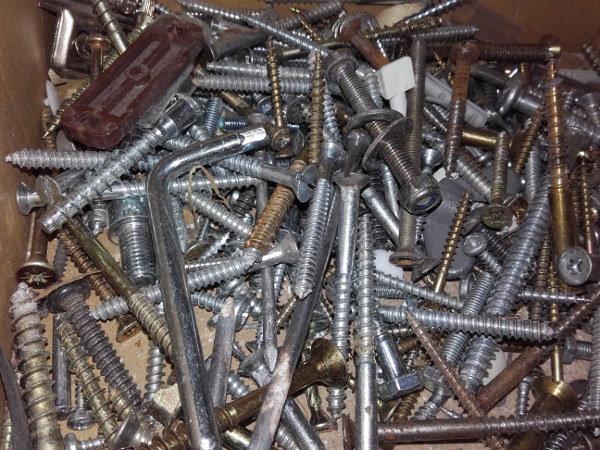
In order to click on gold screw in this screenshot , I will do `click(317, 375)`, `click(557, 394)`, `click(125, 282)`.